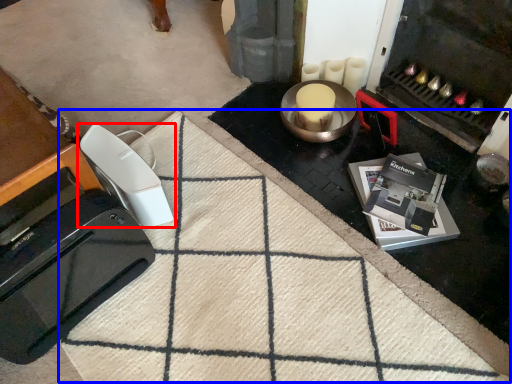
Question: Which object is closer to the camera taking this photo, home appliance (highlighted by a red box) or doormat (highlighted by a blue box)?

Choices:
 (A) home appliance
 (B) doormat

Answer: (B)